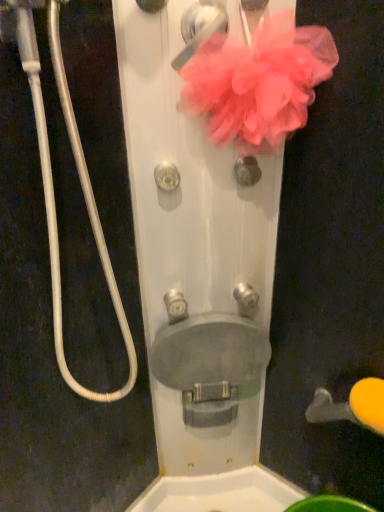
Question: Is satin silver knob at center, the 1th knob viewed from the right, closer to camera compared to pink mesh flower at upper center?

Choices:
 (A) yes
 (B) no

Answer: (B)

Question: From a real-world perspective, is satin silver knob at center, the 1th knob viewed from the right, beneath pink mesh flower at upper center?

Choices:
 (A) no
 (B) yes

Answer: (B)

Question: From the image's perspective, is satin silver knob at center, arranged as the 2th knob when ordered from the bottom, located above pink mesh flower at upper center?

Choices:
 (A) yes
 (B) no

Answer: (B)

Question: From the image's perspective, does satin silver knob at center, the 4th knob from the left, appear lower than pink mesh flower at upper center?

Choices:
 (A) yes
 (B) no

Answer: (A)

Question: From a real-world perspective, is satin silver knob at center, the 3th knob positioned from the top, on pink mesh flower at upper center?

Choices:
 (A) no
 (B) yes

Answer: (A)

Question: Considering the relative positions of satin silver knob at center, the 3th knob positioned from the top, and pink mesh flower at upper center in the image provided, is satin silver knob at center, the 3th knob positioned from the top, to the left of pink mesh flower at upper center from the viewer's perspective?

Choices:
 (A) no
 (B) yes

Answer: (A)

Question: Does metallic silver knob at center, which appears as the fourth knob when viewed from the top, have a smaller size compared to satin silver knob at center, the 3th knob positioned from the top?

Choices:
 (A) yes
 (B) no

Answer: (A)

Question: Are metallic silver knob at center, which appears as the fourth knob when viewed from the top, and satin silver knob at center, the 3th knob positioned from the top, far apart?

Choices:
 (A) yes
 (B) no

Answer: (B)

Question: Considering the relative sizes of metallic silver knob at center, the 3th knob positioned from the right, and satin silver knob at center, arranged as the 2th knob when ordered from the bottom, in the image provided, is metallic silver knob at center, the 3th knob positioned from the right, thinner than satin silver knob at center, arranged as the 2th knob when ordered from the bottom,?

Choices:
 (A) yes
 (B) no

Answer: (A)

Question: Could you tell me if metallic silver knob at center, which appears as the fourth knob when viewed from the top, is facing satin silver knob at center, arranged as the 2th knob when ordered from the bottom?

Choices:
 (A) yes
 (B) no

Answer: (B)

Question: Considering the relative sizes of metallic silver knob at center, the 3th knob positioned from the right, and satin silver knob at center, the 3th knob positioned from the top, in the image provided, is metallic silver knob at center, the 3th knob positioned from the right, bigger than satin silver knob at center, the 3th knob positioned from the top,?

Choices:
 (A) yes
 (B) no

Answer: (B)

Question: Considering the relative positions of metallic silver knob at center, arranged as the second knob when viewed from the left, and satin silver knob at center, the 1th knob viewed from the right, in the image provided, is metallic silver knob at center, arranged as the second knob when viewed from the left, to the right of satin silver knob at center, the 1th knob viewed from the right, from the viewer's perspective?

Choices:
 (A) yes
 (B) no

Answer: (B)

Question: Can we say pink fabric door handle at upper center, which appears as the first door handle when viewed from the left, lies outside yellow rubber door handle at lower right, acting as the second door handle starting from the top?

Choices:
 (A) no
 (B) yes

Answer: (B)